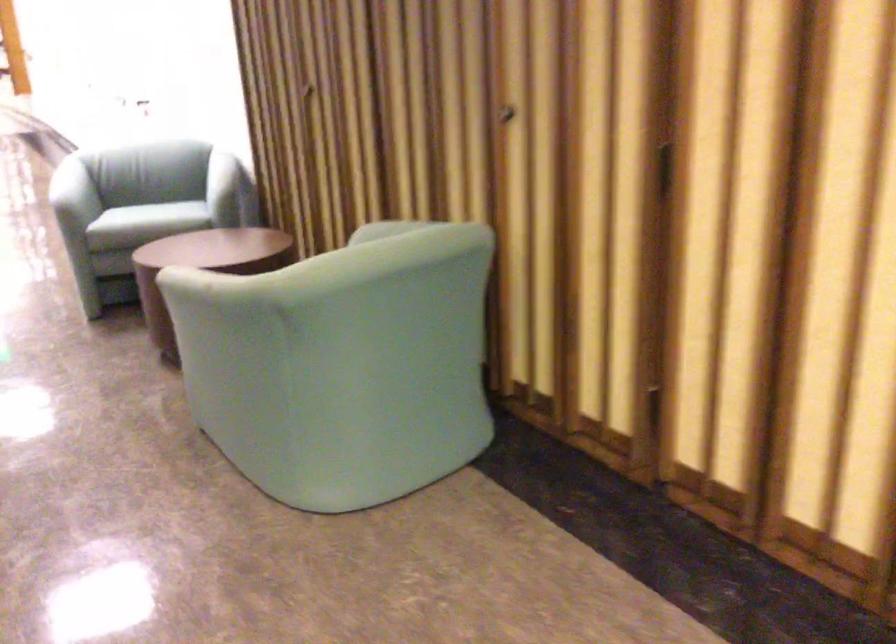
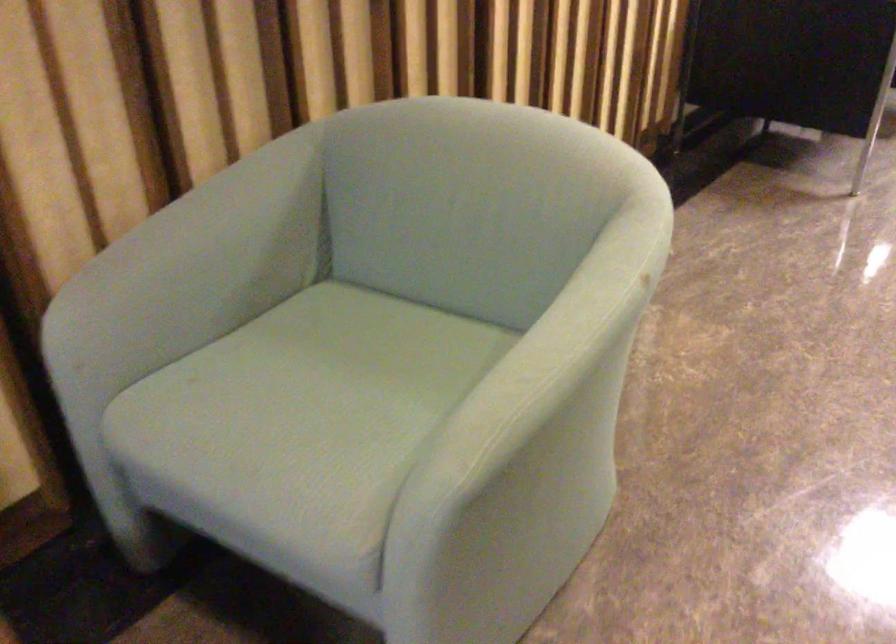
The point at (186, 268) is marked in the first image. Where is the corresponding point in the second image?

(533, 375)